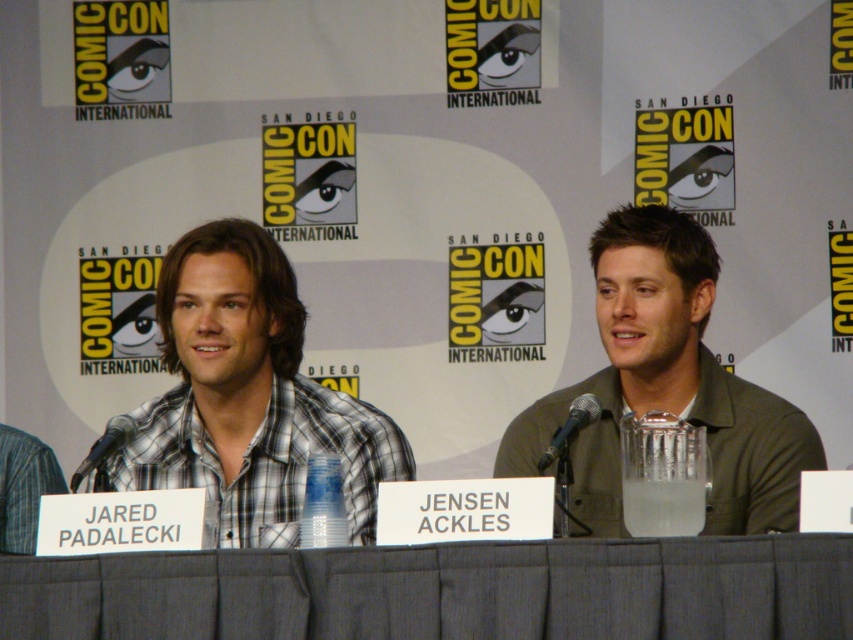
Question: Which point appears closest to the camera in this image?

Choices:
 (A) (610, 456)
 (B) (637, 600)

Answer: (B)

Question: Which object appears closest to the camera in this image?

Choices:
 (A) green matte shirt at center
 (B) gray fabric table at center

Answer: (B)

Question: In this image, where is gray fabric table at center located relative to plaid cotton shirt at left?

Choices:
 (A) below
 (B) above

Answer: (A)

Question: Is gray fabric table at center to the left of plaid cotton shirt at left from the viewer's perspective?

Choices:
 (A) yes
 (B) no

Answer: (B)

Question: Does gray fabric table at center have a smaller size compared to plaid cotton shirt at left?

Choices:
 (A) no
 (B) yes

Answer: (B)

Question: Among these objects, which one is farthest from the camera?

Choices:
 (A) plaid cotton shirt at left
 (B) green matte shirt at center
 (C) gray fabric table at center

Answer: (A)